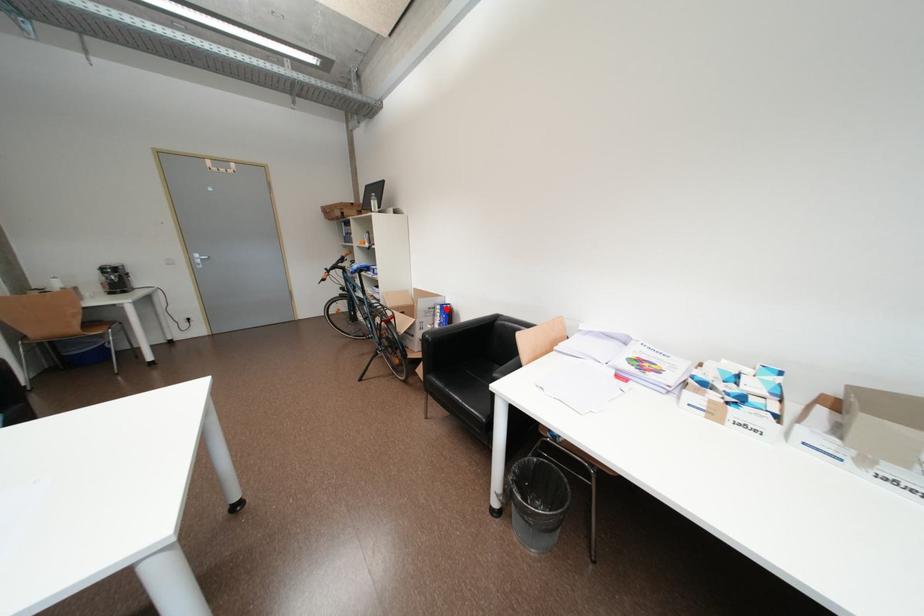
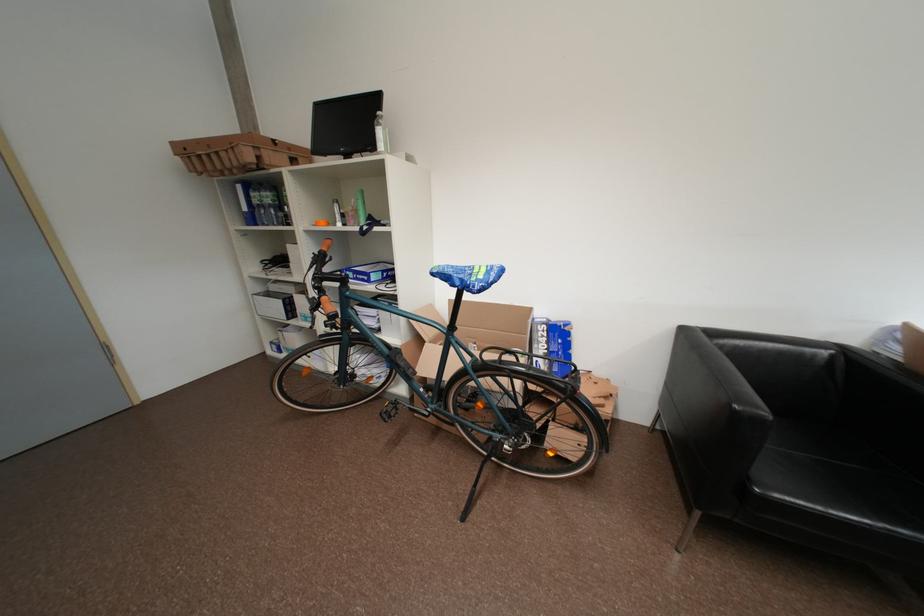
Locate, in the second image, the point that corresponds to the highlighted location in the first image.

(553, 329)